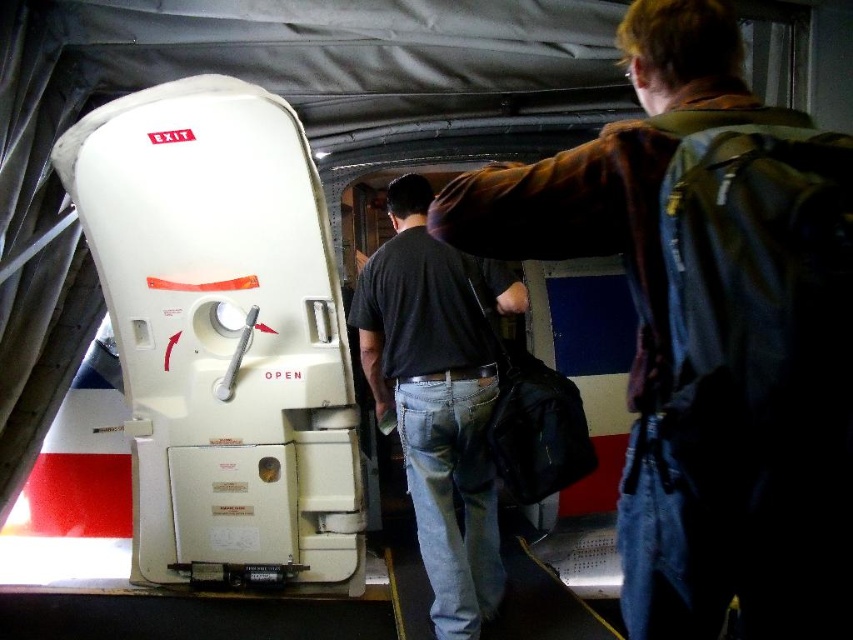
You are a flight attendant preparing to distribute emergency equipment. You see a denim jacket at upper right and dark blue jeans at center. Which item is wider?

The denim jacket at upper right is wider than the dark blue jeans at center.

You are a flight attendant preparing to secure items in the aircraft cargo hold. You see a denim jacket at upper right and dark blue jeans at center. Which item is positioned more to the right side of the cargo hold?

The denim jacket at upper right is positioned more to the right side of the cargo hold compared to the dark blue jeans at center.

You are a flight attendant preparing for an emergency evacuation. You notice a denim jacket at upper right and dark blue jeans at center in the cargo hold. Which item takes up more space in the cargo hold?

The dark blue jeans at center occupies more space than the denim jacket at upper right, so the dark blue jeans at center takes up more space in the cargo hold.